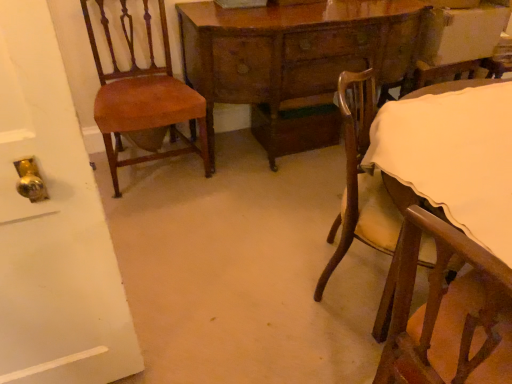
Question: Is wooden chair with cream cushion at lower right, which is counted as the second chair, starting from the left, closer to the viewer compared to wooden table at center?

Choices:
 (A) no
 (B) yes

Answer: (B)

Question: Is wooden chair with cream cushion at lower right, which ranks as the 1th chair in right-to-left order, not within wooden table at center?

Choices:
 (A) yes
 (B) no

Answer: (A)

Question: Can you confirm if wooden chair with cream cushion at lower right, which is counted as the second chair, starting from the left, is taller than wooden table at center?

Choices:
 (A) no
 (B) yes

Answer: (A)

Question: From a real-world perspective, is wooden chair with cream cushion at lower right, which is counted as the second chair, starting from the left, on wooden table at center?

Choices:
 (A) no
 (B) yes

Answer: (A)

Question: Is wooden chair with cream cushion at lower right, which is counted as the second chair, starting from the left, aimed at wooden table at center?

Choices:
 (A) no
 (B) yes

Answer: (A)

Question: Does wooden chair with cream cushion at lower right, which is counted as the second chair, starting from the left, have a lesser width compared to wooden table at center?

Choices:
 (A) yes
 (B) no

Answer: (B)

Question: Is wooden table at center in front of mahogany wood chair at left, which ranks as the first chair in left-to-right order?

Choices:
 (A) no
 (B) yes

Answer: (A)

Question: From the image's perspective, does wooden table at center appear lower than mahogany wood chair at left, which ranks as the 2th chair in right-to-left order?

Choices:
 (A) no
 (B) yes

Answer: (A)

Question: From a real-world perspective, does wooden table at center stand above mahogany wood chair at left, which ranks as the first chair in left-to-right order?

Choices:
 (A) no
 (B) yes

Answer: (A)

Question: Considering the relative positions of wooden table at center and mahogany wood chair at left, which ranks as the 2th chair in right-to-left order, in the image provided, is wooden table at center to the right of mahogany wood chair at left, which ranks as the 2th chair in right-to-left order, from the viewer's perspective?

Choices:
 (A) yes
 (B) no

Answer: (A)

Question: From the image's perspective, does wooden table at center appear higher than mahogany wood chair at left, which ranks as the 2th chair in right-to-left order?

Choices:
 (A) no
 (B) yes

Answer: (B)

Question: Is wooden table at center behind mahogany wood chair at left, which ranks as the first chair in left-to-right order?

Choices:
 (A) no
 (B) yes

Answer: (B)

Question: From the image's perspective, would you say mahogany wood chair at left, which ranks as the 2th chair in right-to-left order, is positioned over wooden table at center?

Choices:
 (A) yes
 (B) no

Answer: (B)